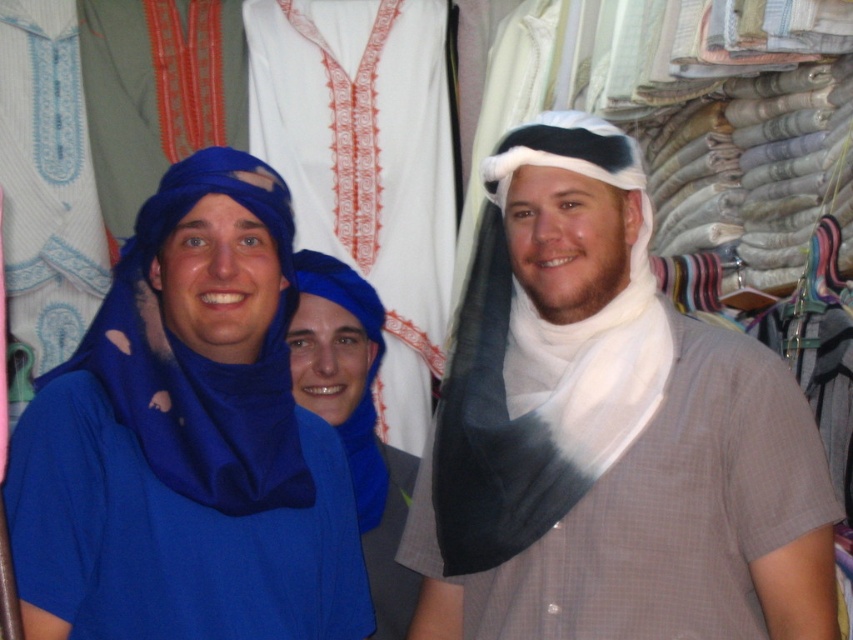
Identify the location of blue soft fabric scarf at left. The width and height of the screenshot is (853, 640). pos(201,356).

Can you confirm if blue soft fabric scarf at left is positioned above blue cotton turban at center?

Yes.

Is point (143, 333) closer to viewer compared to point (381, 556)?

Yes, point (143, 333) is closer to viewer.

Find the location of a particular element. Image resolution: width=853 pixels, height=640 pixels. blue soft fabric scarf at left is located at coordinates (201, 356).

Is white matte headscarf at center closer to the viewer compared to white sheer scarf at center?

Yes, it is in front of white sheer scarf at center.

From the picture: Measure the distance from white matte headscarf at center to white sheer scarf at center.

white matte headscarf at center is 10.52 inches from white sheer scarf at center.

Does point (486, 604) come closer to viewer compared to point (514, 284)?

Yes, point (486, 604) is closer to viewer.

Where is `white matte headscarf at center`? The width and height of the screenshot is (853, 640). white matte headscarf at center is located at coordinates coord(608,433).

Is white sheer scarf at center taller than blue soft fabric scarf at left?

Yes, white sheer scarf at center is taller than blue soft fabric scarf at left.

Is point (442, 451) less distant than point (142, 438)?

No.

Which is in front, point (608, 308) or point (172, 490)?

Positioned in front is point (172, 490).

Find the location of a particular element. This screenshot has height=640, width=853. white sheer scarf at center is located at coordinates (540, 365).